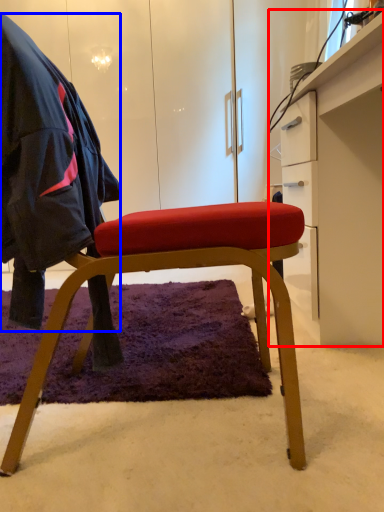
Question: Which of the following is the closest to the observer, desk (highlighted by a red box) or cloak (highlighted by a blue box)?

Choices:
 (A) desk
 (B) cloak

Answer: (B)